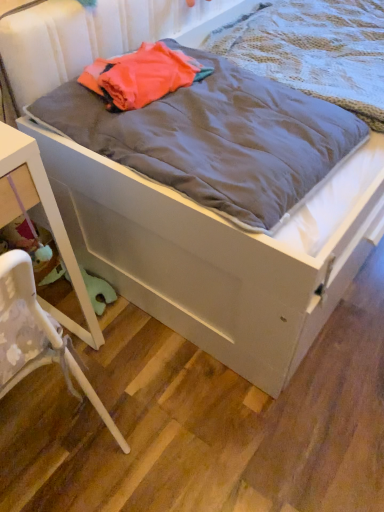
Question: From a real-world perspective, relative to gray cotton blanket at center, acting as the first blanket starting from the front, is gray soft blanket at center, positioned as the 2th blanket in front-to-back order, vertically above or below?

Choices:
 (A) below
 (B) above

Answer: (A)

Question: Is gray soft blanket at center, positioned as the 2th blanket in front-to-back order, to the left or to the right of gray cotton blanket at center, acting as the first blanket starting from the front, in the image?

Choices:
 (A) left
 (B) right

Answer: (B)

Question: Considering the real-world distances, which object is closest to the white plastic chair at lower left?

Choices:
 (A) white glossy nightstand at lower left
 (B) gray cotton blanket at center, placed as the 2th blanket when sorted from back to front
 (C) gray soft blanket at center, positioned as the 2th blanket in front-to-back order

Answer: (A)

Question: Estimate the real-world distances between objects in this image. Which object is farther from the gray cotton blanket at center, placed as the 2th blanket when sorted from back to front?

Choices:
 (A) gray soft blanket at center, positioned as the first blanket in back-to-front order
 (B) white plastic chair at lower left
 (C) white glossy nightstand at lower left

Answer: (B)